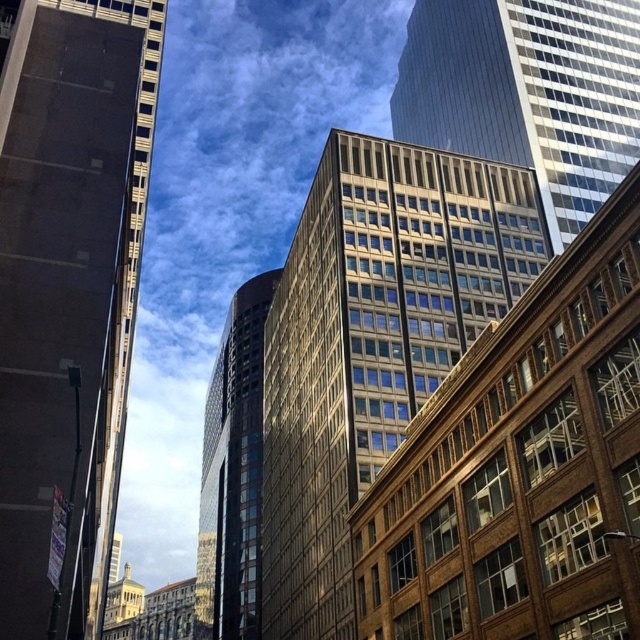
Question: Estimate the real-world distances between objects in this image. Which object is farther from the glassy reflective tower at center?

Choices:
 (A) glassy reflective skyscraper at center
 (B) glassy reflective building at center

Answer: (A)

Question: Where is dark glass skyscraper at left located in relation to glassy reflective building at center in the image?

Choices:
 (A) below
 (B) above

Answer: (B)

Question: Does glassy reflective skyscraper at center have a larger size compared to glassy reflective tower at center?

Choices:
 (A) no
 (B) yes

Answer: (A)

Question: Is dark glass skyscraper at left closer to camera compared to glassy reflective tower at center?

Choices:
 (A) yes
 (B) no

Answer: (A)

Question: Which is farther from the dark glass skyscraper at left?

Choices:
 (A) glassy reflective tower at center
 (B) glassy reflective skyscraper at center
 (C) glassy reflective building at center

Answer: (A)

Question: Which of the following is the closest to the observer?

Choices:
 (A) (403, 394)
 (B) (250, 305)
 (C) (17, 99)
 (D) (588, 182)

Answer: (C)